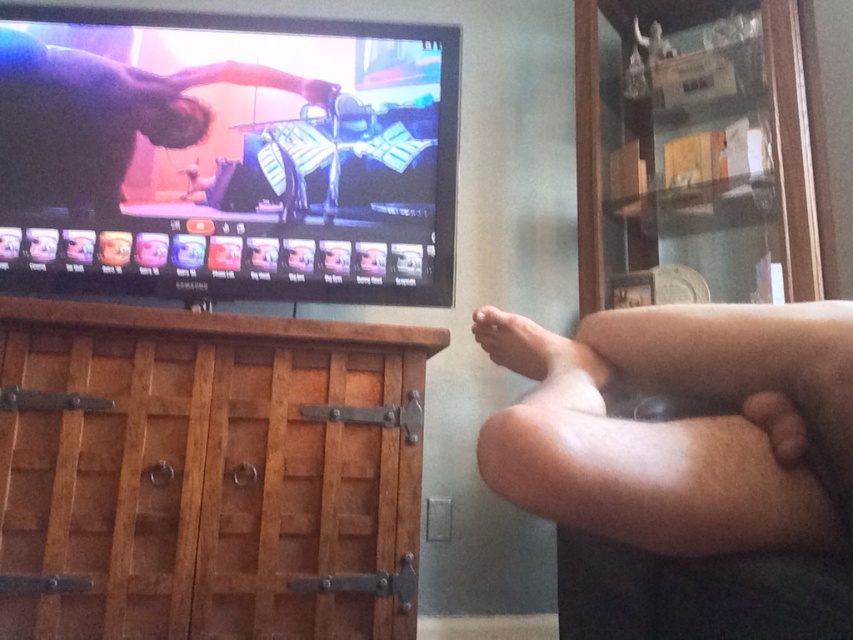
Question: Is the position of smooth skin at center more distant than that of pale skin foot at lower right?

Choices:
 (A) no
 (B) yes

Answer: (B)

Question: From the image, what is the correct spatial relationship of skinny flesh at lower right in relation to pale skin foot at lower right?

Choices:
 (A) left
 (B) right

Answer: (B)

Question: Can you confirm if brown wood cabinet at left is positioned to the left of pale skin foot at lower right?

Choices:
 (A) yes
 (B) no

Answer: (A)

Question: Which point appears farthest from the camera in this image?

Choices:
 (A) (543, 356)
 (B) (99, 81)
 (C) (62, 308)

Answer: (B)

Question: Which is nearer to the brown wood cabinet at left?

Choices:
 (A) pale skin foot at lower right
 (B) smooth skin at center

Answer: (A)

Question: Which of these objects is positioned farthest from the brown wood cabinet at left?

Choices:
 (A) skinny flesh at lower right
 (B) pale skin foot at lower right
 (C) smooth skin at center

Answer: (A)